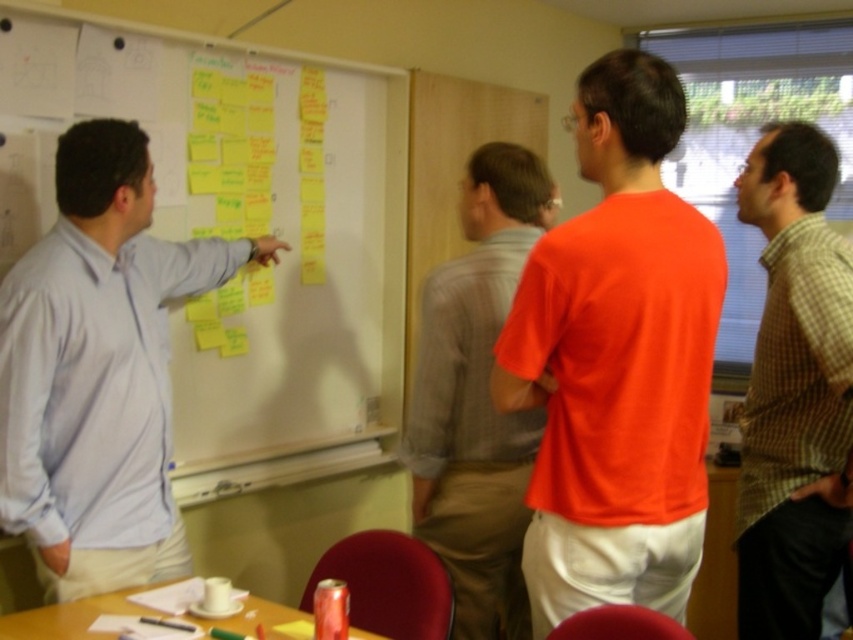
Question: Where is light blue shirt at left located in relation to orange t-shirt at center in the image?

Choices:
 (A) right
 (B) left

Answer: (B)

Question: Estimate the real-world distances between objects in this image. Which object is closer to the light blue shirt at left?

Choices:
 (A) orange t-shirt at center
 (B) yellow sticky notes at upper left

Answer: (B)

Question: Considering the relative positions of yellow sticky notes at upper left and orange t-shirt at center in the image provided, where is yellow sticky notes at upper left located with respect to orange t-shirt at center?

Choices:
 (A) below
 (B) above

Answer: (B)

Question: Among these objects, which one is nearest to the camera?

Choices:
 (A) green checkered shirt at right
 (B) orange matte shirt at center
 (C) yellow sticky notes at upper left

Answer: (B)

Question: Considering the real-world distances, which object is closest to the orange matte shirt at center?

Choices:
 (A) green checkered shirt at right
 (B) light blue shirt at left
 (C) orange t-shirt at center
 (D) yellow sticky notes at upper left

Answer: (C)

Question: Is orange matte shirt at center in front of orange t-shirt at center?

Choices:
 (A) yes
 (B) no

Answer: (A)